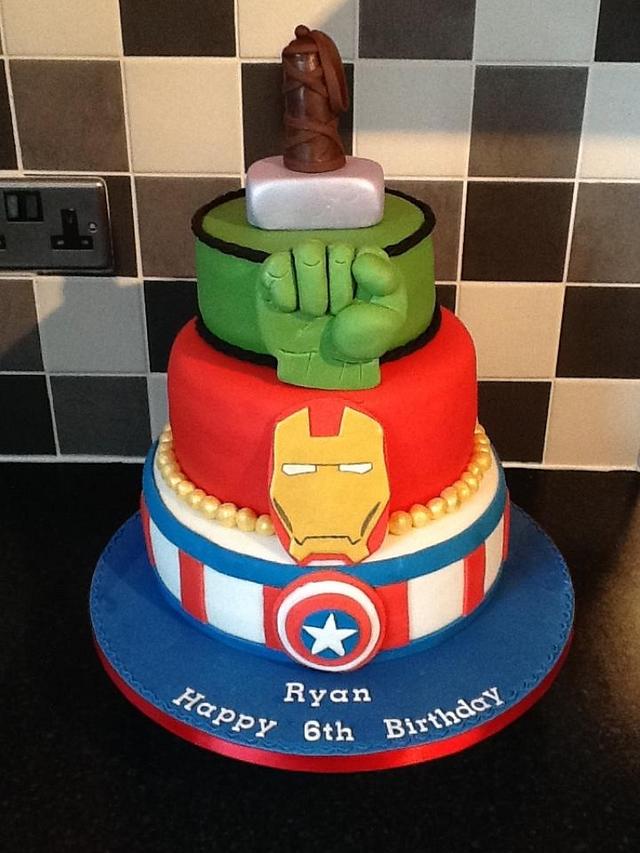
Locate an element on the screen. This screenshot has width=640, height=853. tile wall is located at coordinates (189, 111).